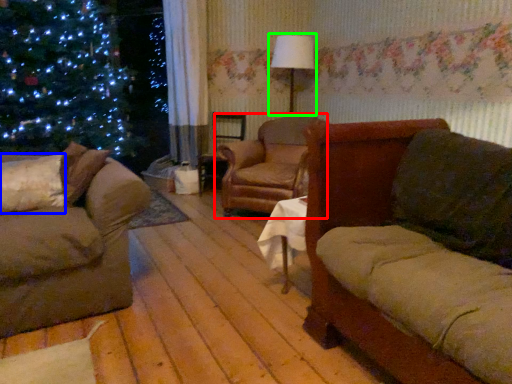
Question: Based on their relative distances, which object is farther from chair (highlighted by a red box)? Choose from pillow (highlighted by a blue box) and lamp (highlighted by a green box).

Choices:
 (A) pillow
 (B) lamp

Answer: (A)